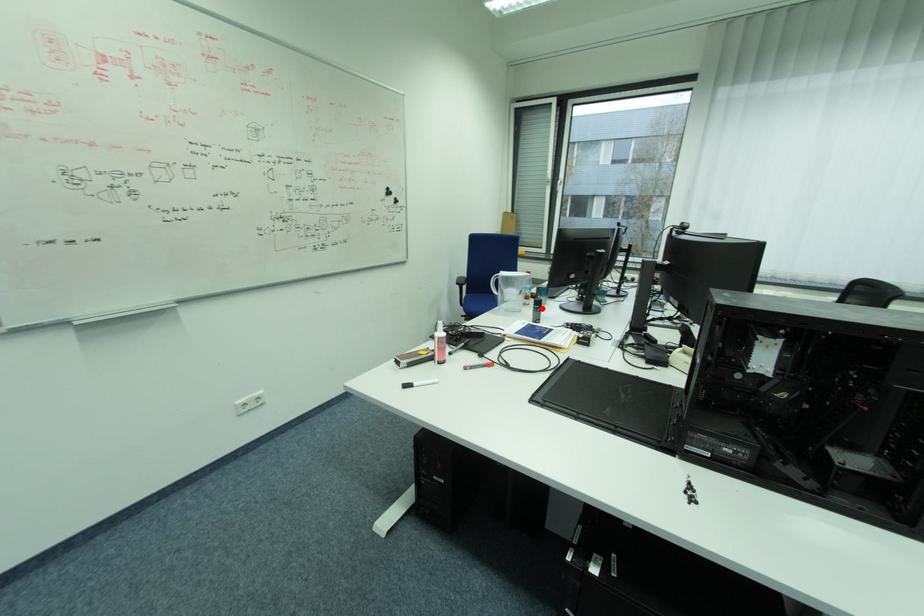
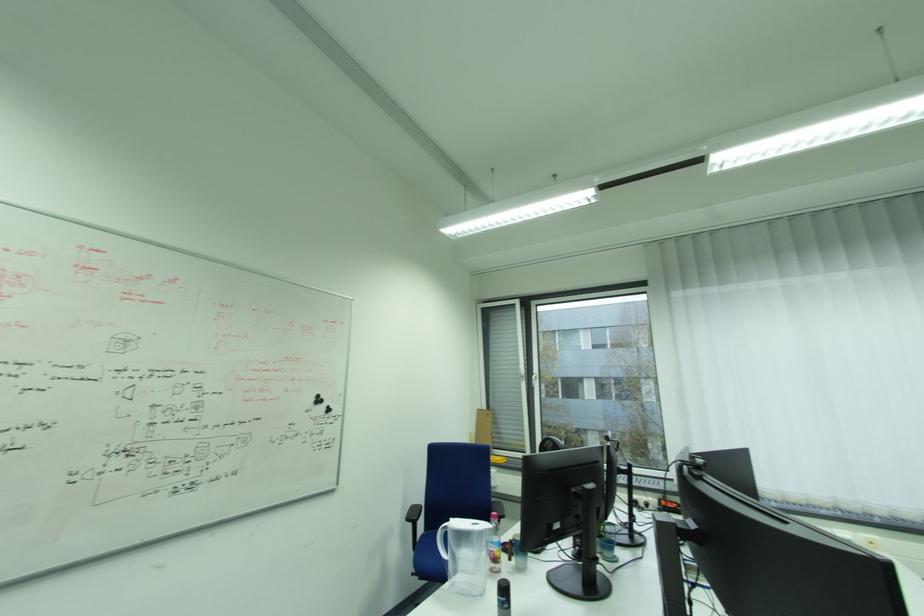
The point at the highlighted location is marked in the first image. Where is the corresponding point in the second image?

(505, 600)